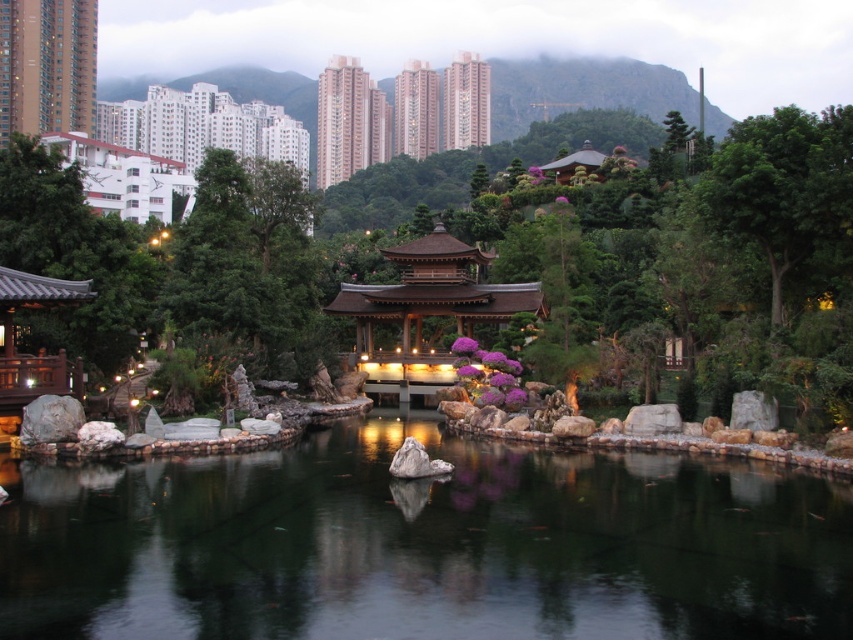
You are planning to place a new statue in the garden. The statue requires a base that can support its weight. Which temple, the pink concrete temple at upper center or the matte brown temple at upper left, would you choose as the base location if you want to ensure stability?

The pink concrete temple at upper center is larger in size than the matte brown temple at upper left, so it would provide a more stable base for the statue.

You are planning to place a small floating decoration in the garden. The decoration requires a water surface that is wider than the matte brown temple at upper left. Based on the scene, can the transparent water at center accommodate this requirement?

The transparent water at center might be wider than matte brown temple at upper left, so it is possible that the transparent water at center can accommodate the decoration requirement.